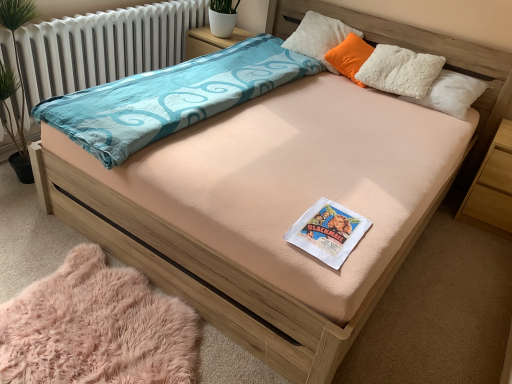
Question: Considering their positions, is light brown wood at right located in front of or behind white fluffy pillow at upper right, which appears as the first pillow when viewed from the top?

Choices:
 (A) behind
 (B) front

Answer: (B)

Question: Visually, is light brown wood at right positioned to the left or to the right of white fluffy pillow at upper right, which appears as the first pillow when viewed from the top?

Choices:
 (A) right
 (B) left

Answer: (A)

Question: Which object is the closest to the light brown wood at right?

Choices:
 (A) orange soft pillow at upper right, which appears as the first pillow when ordered from the bottom
 (B) pink fluffy rug at lower left
 (C) white paper book at center
 (D) white radiator at upper left
 (E) white fluffy pillow at upper right, which appears as the first pillow when viewed from the top

Answer: (A)

Question: Which is farther from the white radiator at upper left?

Choices:
 (A) white fluffy pillow at upper right, which is the second pillow in bottom-to-top order
 (B) light brown wood at right
 (C) orange soft pillow at upper right, the 2th pillow from the top
 (D) white paper book at center
 (E) pink fluffy rug at lower left

Answer: (B)